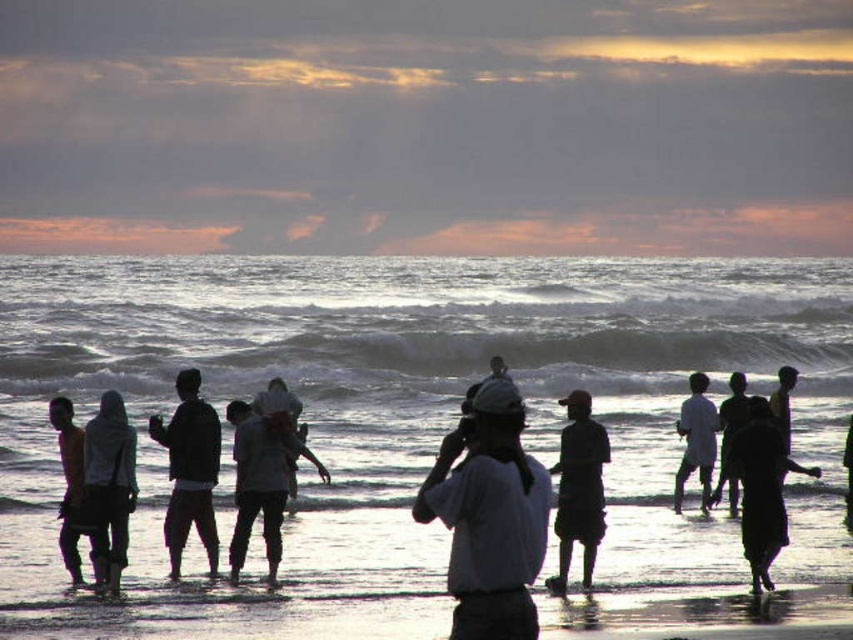
You are a photographer standing on the beach and want to capture both the white cotton shirt at center and the dark gray fabric dress at center right in your shot. Based on their heights, which one might appear more prominent in the photo?

The dark gray fabric dress at center right is taller than the white cotton shirt at center, so it will appear more prominent in the photo.

You are a photographer trying to capture the perfect shot of the beach scene. You notice two clothing items in the frame. The first is a light gray fabric shirt at center and the second is a dark gray fabric at right. Which clothing item appears taller in the photo?

The light gray fabric shirt at center appears taller than the dark gray fabric at right in the photo.

You are a photographer on the beach and want to capture both the white cotton shirt at center and the dark gray fabric dress at center right in the same frame. Which direction should you move your camera to include both subjects?

To include both the white cotton shirt at center and the dark gray fabric dress at center right in the same frame, you should move your camera to the left, as the white cotton shirt at center is positioned to the left of the dark gray fabric dress at center right.